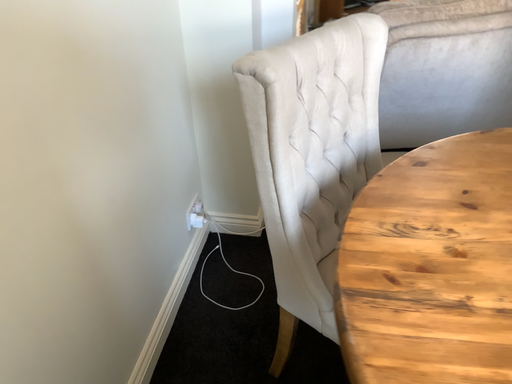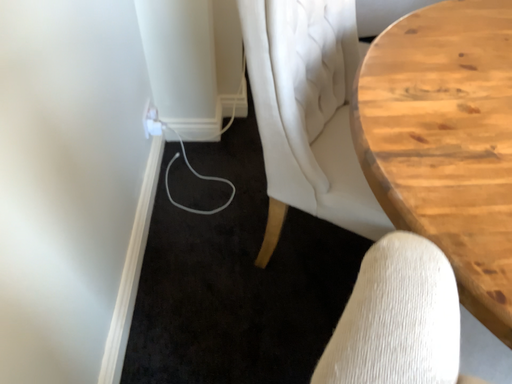
Question: How did the camera likely rotate when shooting the video?

Choices:
 (A) rotated downward
 (B) rotated upward

Answer: (A)